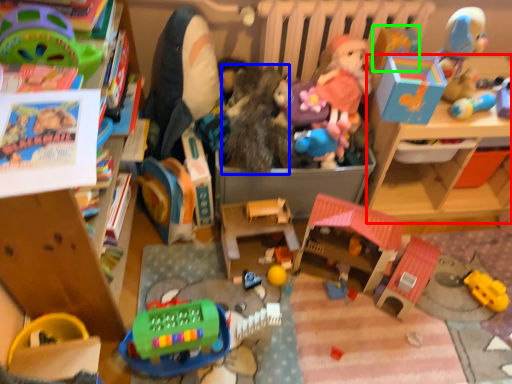
Question: Considering the real-world distances, which object is farthest from changing table (highlighted by a red box)? toy (highlighted by a blue box) or toy (highlighted by a green box)?

Choices:
 (A) toy
 (B) toy

Answer: (A)